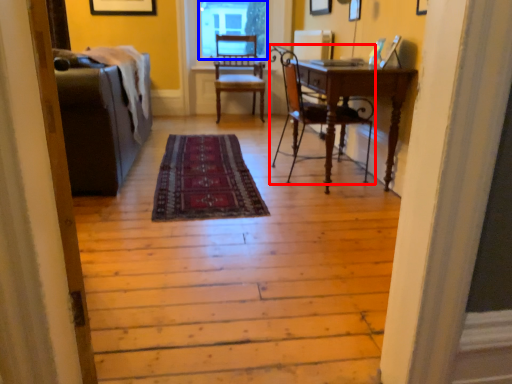
Question: Which of the following is the closest to the observer, chair (highlighted by a red box) or window screen (highlighted by a blue box)?

Choices:
 (A) chair
 (B) window screen

Answer: (A)